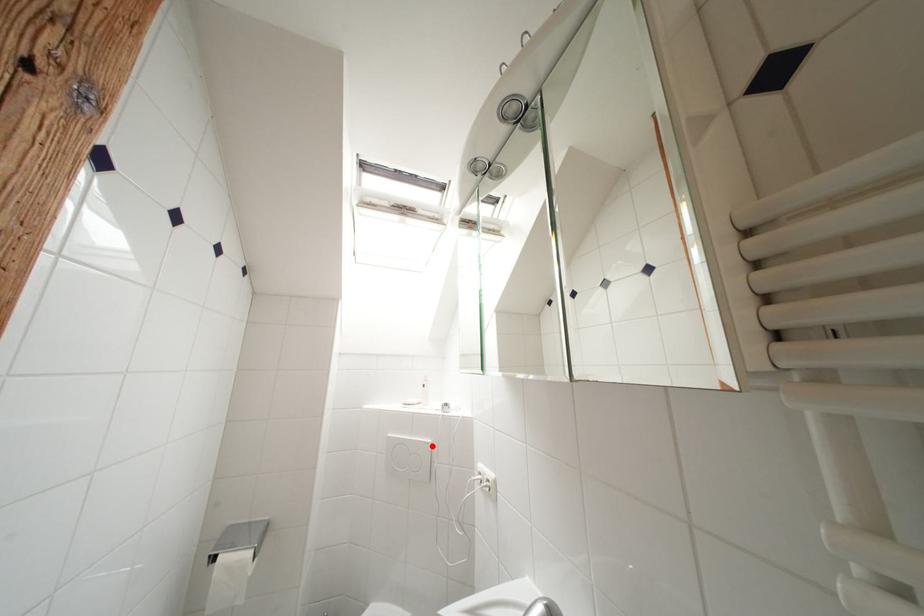
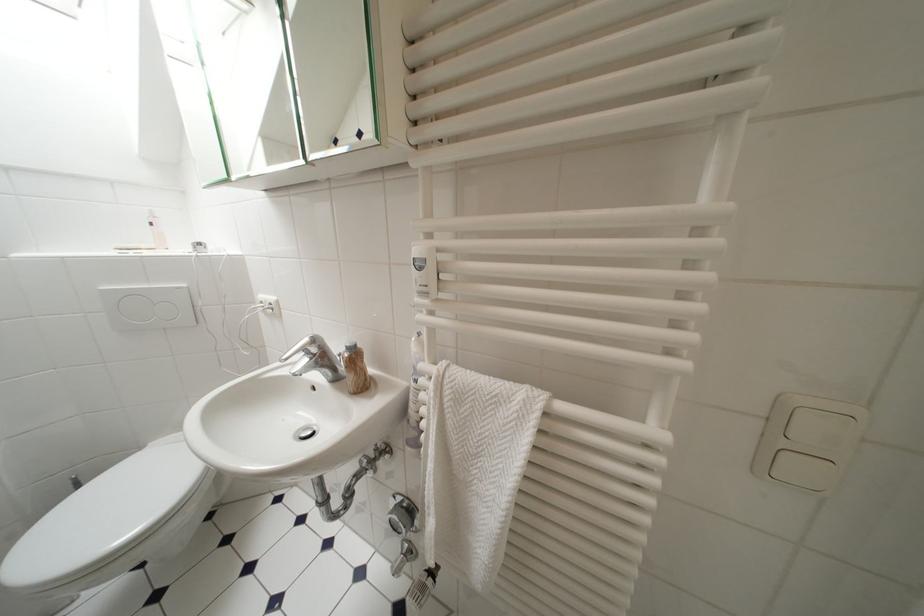
Locate, in the second image, the point that corresponds to the highlighted location in the first image.

(185, 291)